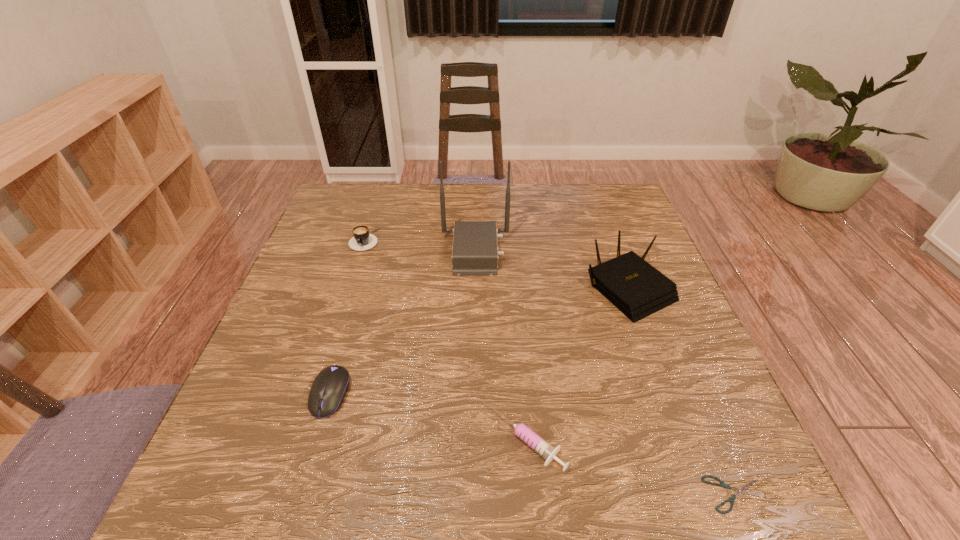
Identify the location of vacant space that is in between the left router and the computer mouse. The height and width of the screenshot is (540, 960). (403, 323).

I want to click on vacant point located between the fifth tallest object and the third tallest object, so click(445, 340).

Where is `vacant space that's between the third tallest object and the fourth tallest object`? This screenshot has width=960, height=540. vacant space that's between the third tallest object and the fourth tallest object is located at coordinates (348, 317).

The width and height of the screenshot is (960, 540). In order to click on vacant area between the third tallest object and the computer mouse in this screenshot , I will do `click(348, 317)`.

Locate an element on the screen. The image size is (960, 540). free space between the taller router and the fourth tallest object is located at coordinates (403, 323).

Image resolution: width=960 pixels, height=540 pixels. What are the coordinates of `free point between the syringe and the cappuccino` in the screenshot? It's located at (445, 340).

Find the location of a particular element. object that ranks as the fifth closest to the right router is located at coordinates (362, 240).

In order to click on object that can be found as the second closest to the second shortest object in this screenshot , I will do `click(636, 288)`.

Where is `vacant point that satisfies the following two spatial constraints: 1. on the back of the fifth tallest object to connect cables; 2. on the left side of the tallest object`? vacant point that satisfies the following two spatial constraints: 1. on the back of the fifth tallest object to connect cables; 2. on the left side of the tallest object is located at coordinates (473, 440).

Identify the location of vacant space that satisfies the following two spatial constraints: 1. on the front side of the computer mouse; 2. on the left side of the nearest object. (301, 494).